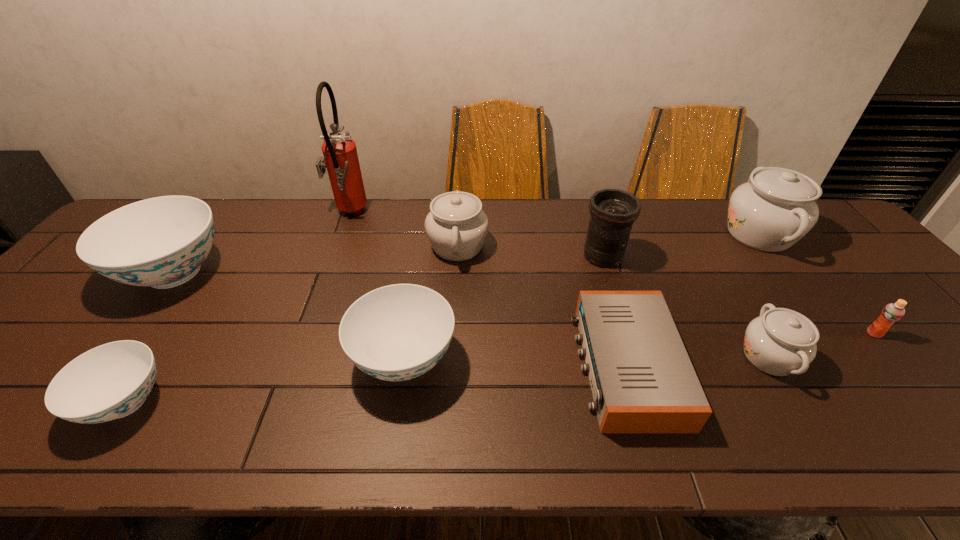
Where is `the third object from left to right`? The height and width of the screenshot is (540, 960). the third object from left to right is located at coordinates (340, 154).

Where is `the tallest object`? the tallest object is located at coordinates (340, 154).

Find the location of a particular element. the biggest white chinaware is located at coordinates (777, 207).

Locate an element on the screen. the tallest chinaware is located at coordinates (777, 207).

What are the coordinates of `telephoto lens` in the screenshot? It's located at (613, 211).

This screenshot has width=960, height=540. In order to click on the leftmost white chinaware in this screenshot , I will do `click(456, 226)`.

I want to click on the farthest blue chinaware, so (161, 242).

The width and height of the screenshot is (960, 540). I want to click on the third object from right to left, so click(780, 342).

At what (x,y) coordinates should I click in order to perform the action: click on the second white chinaware from right to left. Please return your answer as a coordinate pair (x, y). This screenshot has width=960, height=540. Looking at the image, I should click on (780, 342).

Find the location of a particular element. Image resolution: width=960 pixels, height=540 pixels. the second smallest blue chinaware is located at coordinates (398, 332).